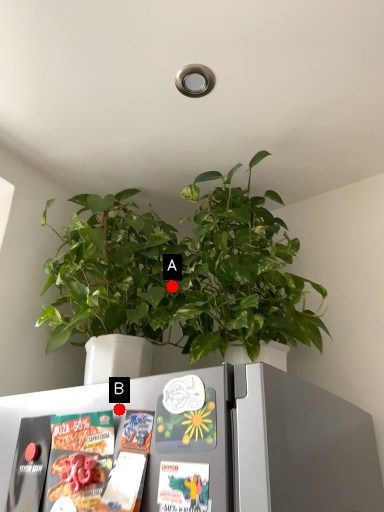
Question: Two points are circled on the image, labeled by A and B beside each circle. Which point is closer to the camera taking this photo?

Choices:
 (A) A is closer
 (B) B is closer

Answer: (B)